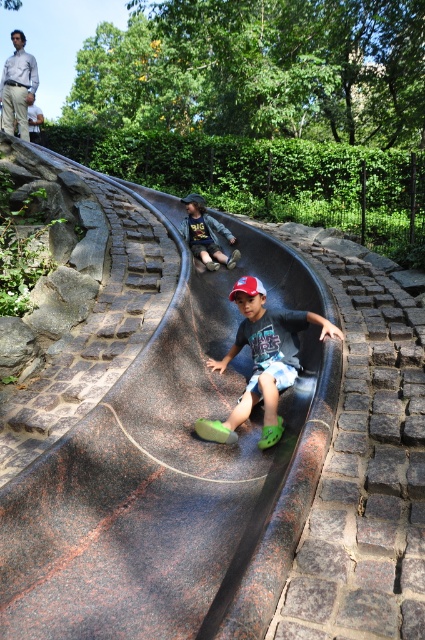
You are standing at the bottom of the slide and want to give a high five to the child wearing the white shirt at upper left. Can you reach them with your arm? Please explain.

The distance between you and the white shirt at upper left is 29.12 feet, which is too far to reach with an arm. You cannot give a high five.

You are a parent watching your child play on the slide. Your child is wearing a dark blue denim jacket at center and is sliding down the rubberized smooth slide at center. You want to ensure the jacket won

The rubberized smooth slide at center is wider than the dark blue denim jacket at center, so the jacket should have enough space to slide down safely without getting caught or damaged.